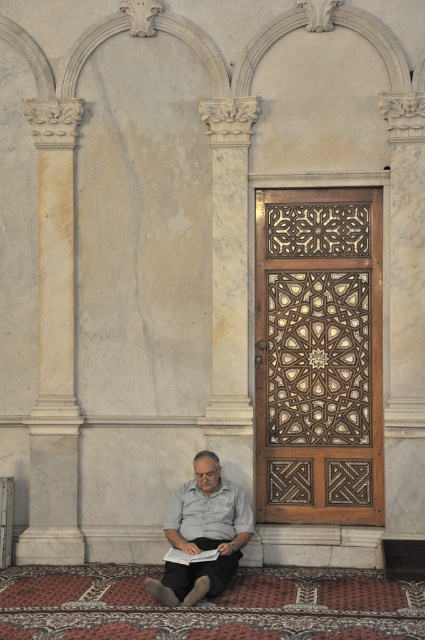
You are standing at the center of the room and see a point marked at coordinates (54, 346). What object is located at that point?

The point at coordinates (54, 346) is where the white marble column at left is located.

Based on the photo, you are standing in the room and want to walk to the white paper book at lower center. Is the white marble column at left blocking your path?

The white marble column at left is further to the viewer than the white paper book at lower center, so it is closer to you and would block your path to the white paper book at lower center.

You are a tour guide leading a group through this historical building. You need to move a small potted plant that is currently placed between the white marble column at left and the white paper book at lower center. The potted plant is 2 feet wide. Can you move it to the space between these two objects without removing it from the area?

The distance between the white marble column at left and the white paper book at lower center is 5.13 feet. Since the potted plant is only 2 feet wide, there is enough space to move it between them without removing it from the area.